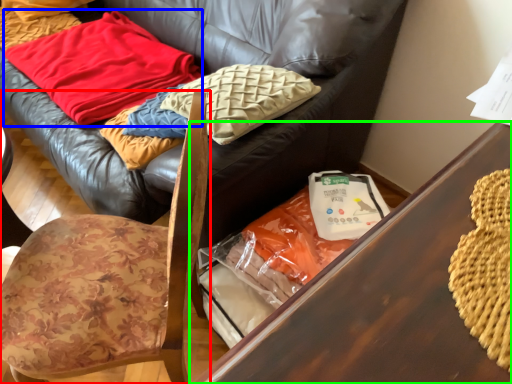
Question: Based on their relative distances, which object is nearer to chair (highlighted by a red box)? Choose from blanket (highlighted by a blue box) and table (highlighted by a green box).

Choices:
 (A) blanket
 (B) table

Answer: (B)